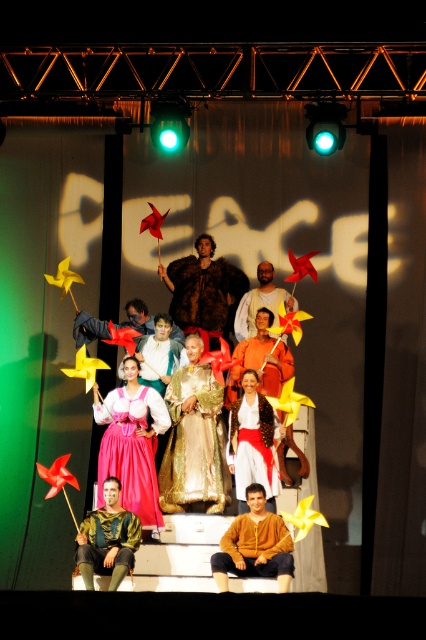
Question: Does fur coat at center appear under gold metallic armor at lower center?

Choices:
 (A) no
 (B) yes

Answer: (A)

Question: Among these points, which one is nearest to the camera?

Choices:
 (A) (282, 538)
 (B) (227, 280)

Answer: (A)

Question: Which point appears farthest from the camera in this image?

Choices:
 (A) (247, 348)
 (B) (199, 284)

Answer: (B)

Question: Can you confirm if brown textured shirt at center is thinner than white satin dress at center?

Choices:
 (A) yes
 (B) no

Answer: (B)

Question: Is the position of brown textured shirt at center more distant than that of orange fabric dress at center?

Choices:
 (A) no
 (B) yes

Answer: (A)

Question: Which is nearer to the white satin dress at center?

Choices:
 (A) orange fabric dress at center
 (B) fur coat at center
 (C) gold metallic armor at lower center
 (D) pink satin dress at center

Answer: (D)